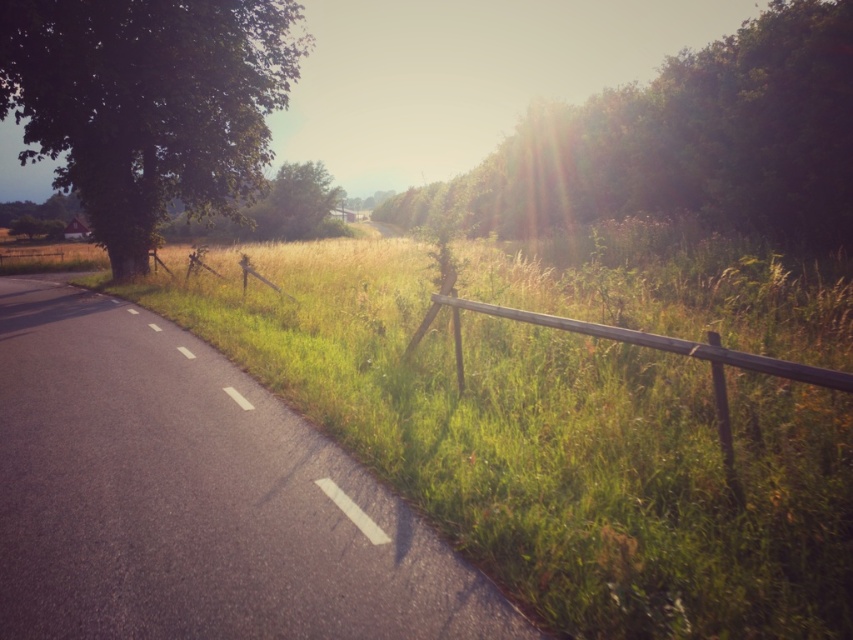
Does green leafy tree at upper right lie behind green leafy tree at left?

No, green leafy tree at upper right is in front of green leafy tree at left.

Is green leafy tree at upper right closer to the viewer compared to green leafy tree at left?

Yes, it is in front of green leafy tree at left.

Locate an element on the screen. The height and width of the screenshot is (640, 853). green leafy tree at upper right is located at coordinates (686, 144).

Which is more to the right, green leafy tree at upper right or wooden fence at right?

Positioned to the right is green leafy tree at upper right.

What do you see at coordinates (686, 144) in the screenshot?
I see `green leafy tree at upper right` at bounding box center [686, 144].

Image resolution: width=853 pixels, height=640 pixels. I want to click on green leafy tree at upper right, so click(x=686, y=144).

Can you confirm if green grass at center is wider than green leafy tree at upper right?

No.

Is point (300, 406) farther from camera compared to point (798, 220)?

No, (300, 406) is in front of (798, 220).

This screenshot has height=640, width=853. Find the location of `green grass at center`. green grass at center is located at coordinates (552, 445).